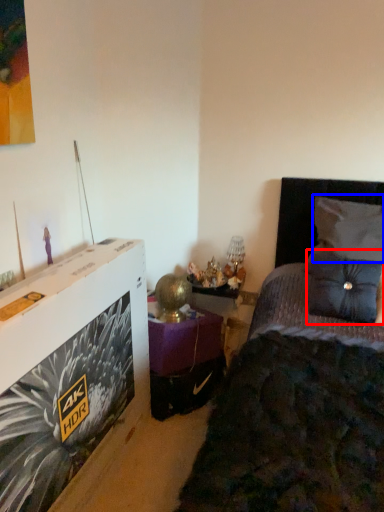
Question: Among these objects, which one is farthest to the camera, pillow (highlighted by a red box) or pillow (highlighted by a blue box)?

Choices:
 (A) pillow
 (B) pillow

Answer: (B)